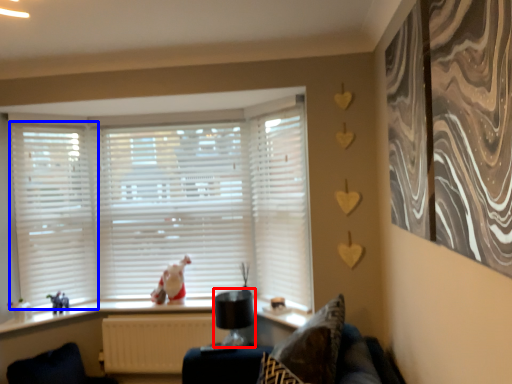
Question: Which object is closer to the camera taking this photo, lamp (highlighted by a red box) or shutter (highlighted by a blue box)?

Choices:
 (A) lamp
 (B) shutter

Answer: (A)